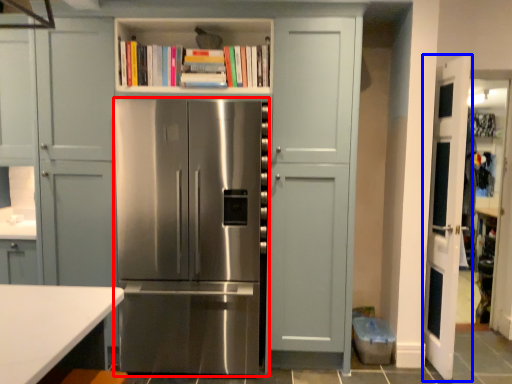
Question: Which object is further to the camera taking this photo, refrigerator (highlighted by a red box) or door (highlighted by a blue box)?

Choices:
 (A) refrigerator
 (B) door

Answer: (B)